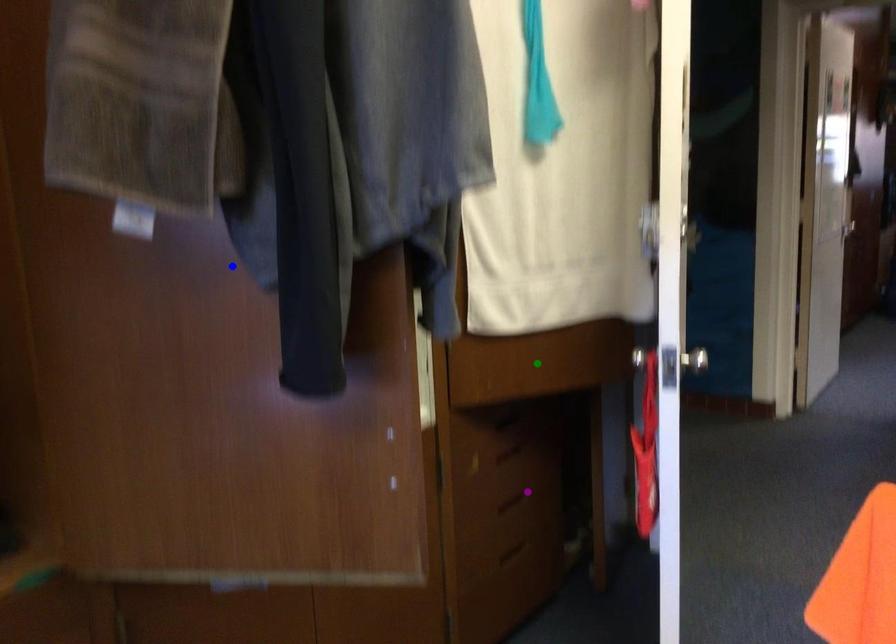
Order these from nearest to farthest:
A) blue point
B) purple point
C) green point

1. blue point
2. green point
3. purple point